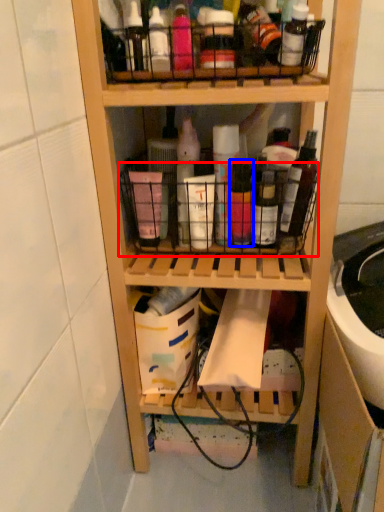
Question: Which point is further to the camera, basket (highlighted by a red box) or bottle (highlighted by a blue box)?

Choices:
 (A) basket
 (B) bottle

Answer: (A)